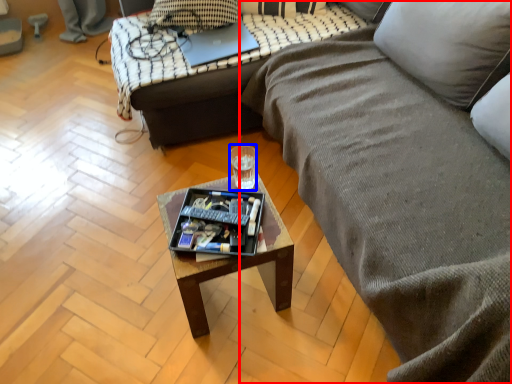
Question: Among these objects, which one is farthest to the camera, studio couch (highlighted by a red box) or coffee cup (highlighted by a blue box)?

Choices:
 (A) studio couch
 (B) coffee cup

Answer: (B)